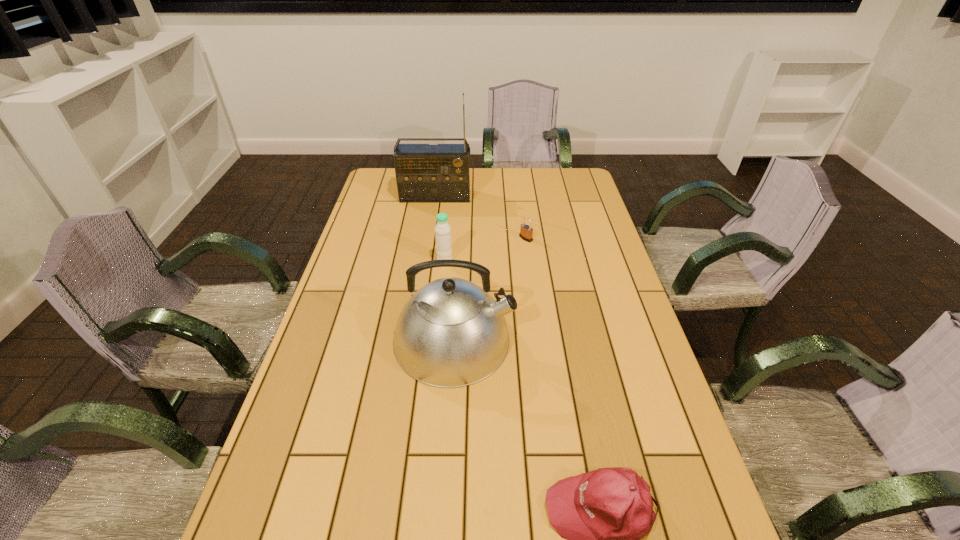
You are a GUI agent. You are given a task and a screenshot of the screen. Output one action in this format:
    pyautogui.click(x=<x>, y=<y>)
    Task: Click on the radio receiver
    
    Given the screenshot: What is the action you would take?
    pyautogui.click(x=425, y=173)

This screenshot has width=960, height=540. What are the coordinates of `the tallest object` in the screenshot? It's located at (425, 173).

The image size is (960, 540). I want to click on kettle, so click(451, 333).

Locate an element on the screen. Image resolution: width=960 pixels, height=540 pixels. the second tallest object is located at coordinates (451, 333).

Locate an element on the screen. The height and width of the screenshot is (540, 960). water bottle is located at coordinates (442, 230).

Where is `the third nearest object`? The width and height of the screenshot is (960, 540). the third nearest object is located at coordinates (442, 230).

You are a GUI agent. You are given a task and a screenshot of the screen. Output one action in this format:
    pyautogui.click(x=<x>, y=<y>)
    Task: Click on the padlock
    Image resolution: width=960 pixels, height=540 pixels.
    Given the screenshot: What is the action you would take?
    pyautogui.click(x=526, y=232)

This screenshot has width=960, height=540. Find the location of `blank space located on the front panel of the tallest object`. blank space located on the front panel of the tallest object is located at coordinates (430, 233).

Identify the location of vacant space located from the spout of the second nearest object. This screenshot has height=540, width=960. (604, 340).

At what (x,y) coordinates should I click in order to perform the action: click on vacant point located 0.300m on the left of the third nearest object. Please return your answer as a coordinate pair (x, y). Looking at the image, I should click on (x=346, y=261).